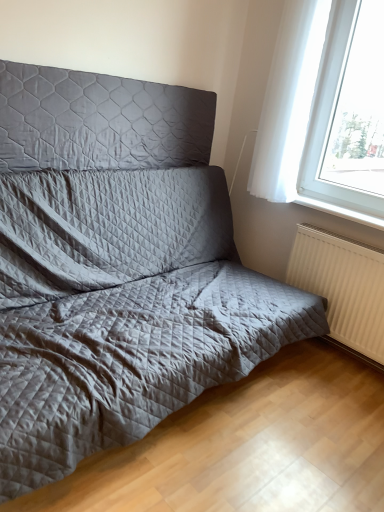
At what (x,y) coordinates should I click in order to perform the action: click on vacant region in front of white textured radiator at lower right. Please return your answer as a coordinate pair (x, y). Looking at the image, I should click on (330, 386).